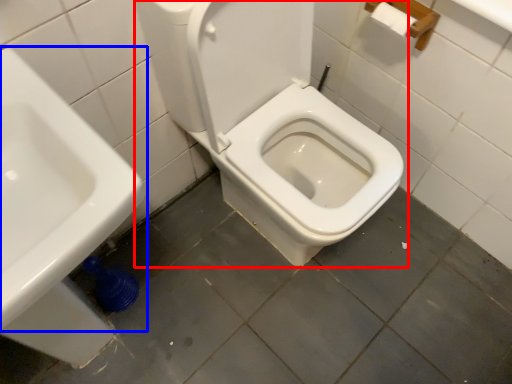
Question: Which object appears closest to the camera in this image, toilet (highlighted by a red box) or sink (highlighted by a blue box)?

Choices:
 (A) toilet
 (B) sink

Answer: (B)